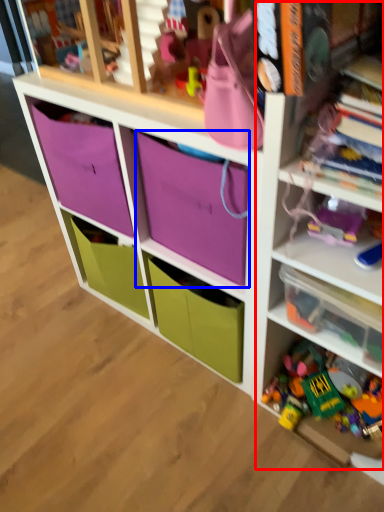
Question: Which object is further to the camera taking this photo, bookshelf (highlighted by a red box) or storage box (highlighted by a blue box)?

Choices:
 (A) bookshelf
 (B) storage box

Answer: (B)